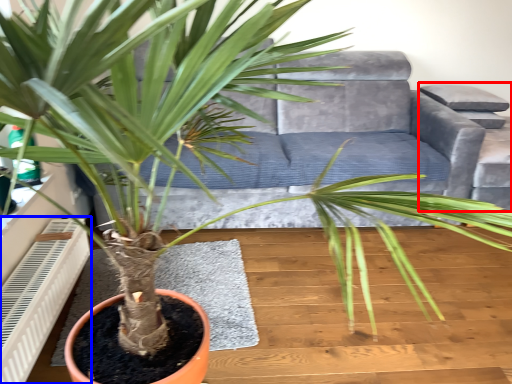
Question: Which point is further to the camera, armchair (highlighted by a red box) or air conditioner (highlighted by a blue box)?

Choices:
 (A) armchair
 (B) air conditioner

Answer: (A)